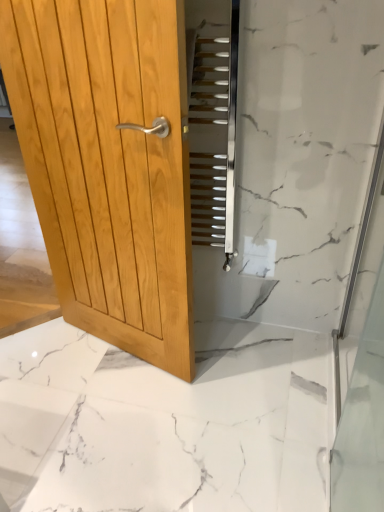
Question: Relative to transparent glass shower door at right, is metallic silver stairs at center in front or behind?

Choices:
 (A) behind
 (B) front

Answer: (A)

Question: From the image's perspective, is metallic silver stairs at center above or below transparent glass shower door at right?

Choices:
 (A) below
 (B) above

Answer: (B)

Question: Based on their relative distances, which object is farther from the white marble floor at center?

Choices:
 (A) metallic silver stairs at center
 (B) transparent glass shower door at right
 (C) light brown wood door at left

Answer: (A)

Question: Which object is the closest to the white marble floor at center?

Choices:
 (A) metallic silver stairs at center
 (B) transparent glass shower door at right
 (C) light brown wood door at left

Answer: (B)